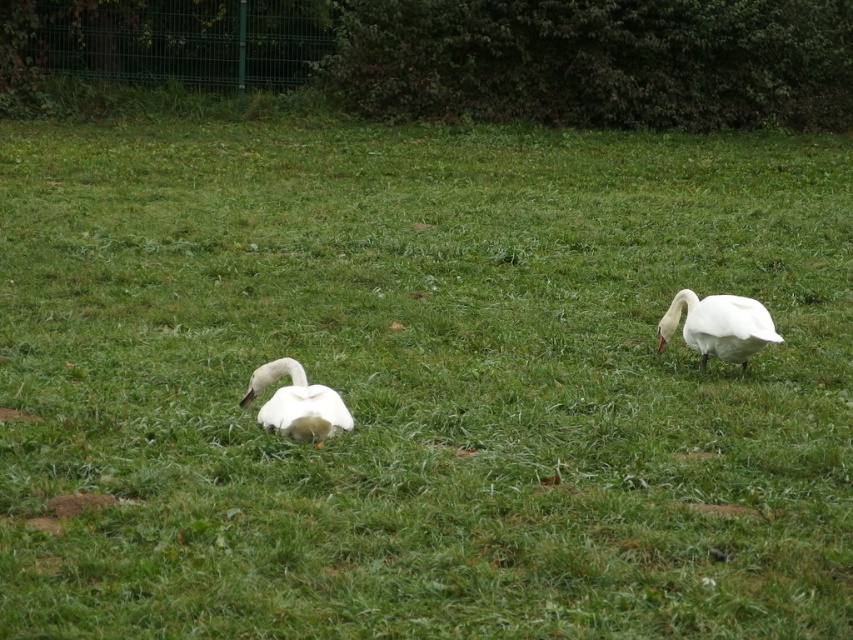
Question: Can you confirm if white matte swan at right is positioned below white matte swan at lower left?

Choices:
 (A) yes
 (B) no

Answer: (B)

Question: Which of the following is the closest to the observer?

Choices:
 (A) white matte swan at lower left
 (B) white matte swan at right

Answer: (A)

Question: Which of the following is the farthest from the observer?

Choices:
 (A) (749, 304)
 (B) (306, 406)

Answer: (A)

Question: Is white matte swan at right smaller than white matte swan at lower left?

Choices:
 (A) yes
 (B) no

Answer: (B)

Question: Considering the relative positions of white matte swan at right and white matte swan at lower left in the image provided, where is white matte swan at right located with respect to white matte swan at lower left?

Choices:
 (A) right
 (B) left

Answer: (A)